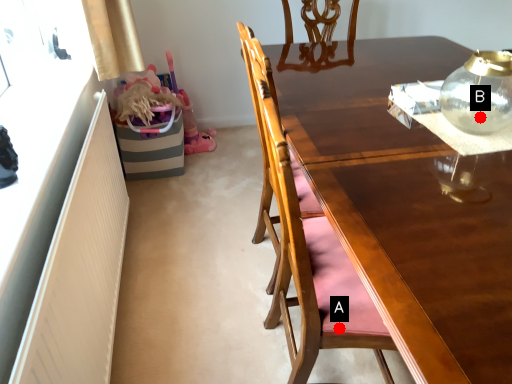
Question: Two points are circled on the image, labeled by A and B beside each circle. Which point is farther to the camera?

Choices:
 (A) A is further
 (B) B is further

Answer: (B)